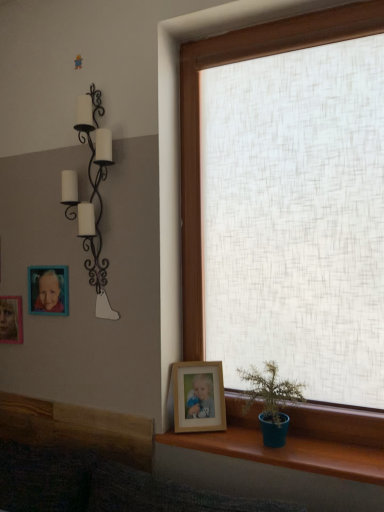
Question: From a real-world perspective, is teal ceramic pot at lower right physically above teak wood window sill at lower right?

Choices:
 (A) yes
 (B) no

Answer: (A)

Question: From the image's perspective, does teal ceramic pot at lower right appear higher than teak wood window sill at lower right?

Choices:
 (A) no
 (B) yes

Answer: (B)

Question: Does teal ceramic pot at lower right have a smaller size compared to teak wood window sill at lower right?

Choices:
 (A) no
 (B) yes

Answer: (A)

Question: Is teal ceramic pot at lower right facing away from teak wood window sill at lower right?

Choices:
 (A) no
 (B) yes

Answer: (A)

Question: Does teal ceramic pot at lower right come behind teak wood window sill at lower right?

Choices:
 (A) no
 (B) yes

Answer: (B)

Question: Considering the relative positions of teak wood window sill at lower right and wooden photo frame at left, the third picture frame when ordered from front to back, in the image provided, is teak wood window sill at lower right to the left or to the right of wooden photo frame at left, the third picture frame when ordered from front to back,?

Choices:
 (A) left
 (B) right

Answer: (B)

Question: Considering the positions of teak wood window sill at lower right and wooden photo frame at left, positioned as the second picture frame in top-to-bottom order, in the image, is teak wood window sill at lower right taller or shorter than wooden photo frame at left, positioned as the second picture frame in top-to-bottom order,?

Choices:
 (A) tall
 (B) short

Answer: (B)

Question: From the image's perspective, is teak wood window sill at lower right above or below wooden photo frame at left, positioned as the second picture frame in top-to-bottom order?

Choices:
 (A) below
 (B) above

Answer: (A)

Question: Considering the positions of point (322, 474) and point (4, 311), is point (322, 474) closer or farther from the camera than point (4, 311)?

Choices:
 (A) farther
 (B) closer

Answer: (B)

Question: Is matte plastic picture frame at upper left, which appears as the first picture frame when viewed from the top, spatially inside wooden photo frame at left, placed as the third picture frame when sorted from right to left, or outside of it?

Choices:
 (A) inside
 (B) outside

Answer: (B)

Question: From the image's perspective, is matte plastic picture frame at upper left, which appears as the first picture frame when viewed from the top, positioned above or below wooden photo frame at left, the 1th picture frame positioned from the back?

Choices:
 (A) above
 (B) below

Answer: (A)

Question: Looking at their shapes, would you say matte plastic picture frame at upper left, the 2th picture frame positioned from the right, is wider or thinner than wooden photo frame at left, the third picture frame when ordered from front to back?

Choices:
 (A) thin
 (B) wide

Answer: (A)

Question: Based on their sizes in the image, would you say matte plastic picture frame at upper left, which appears as the first picture frame when viewed from the top, is bigger or smaller than wooden photo frame at left, which ranks as the second picture frame in bottom-to-top order?

Choices:
 (A) big
 (B) small

Answer: (B)

Question: Relative to teak wood window sill at lower right, is matte plastic picture frame at upper left, placed as the third picture frame when sorted from bottom to top, in front or behind?

Choices:
 (A) behind
 (B) front

Answer: (A)

Question: Looking at their shapes, would you say matte plastic picture frame at upper left, which appears as the first picture frame when viewed from the top, is wider or thinner than teak wood window sill at lower right?

Choices:
 (A) thin
 (B) wide

Answer: (A)